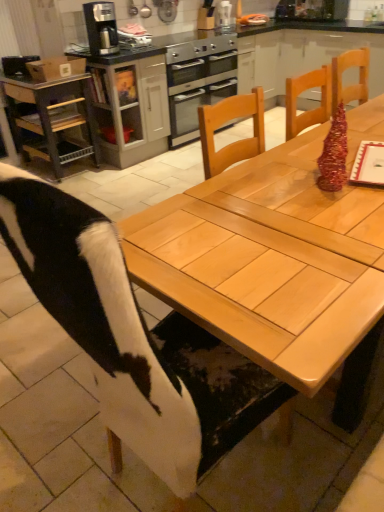
What are the coordinates of `metallic gray cart at left` in the screenshot? It's located at (52, 119).

Measure the distance between satin black coffee maker at upper left and camera.

satin black coffee maker at upper left is 3.31 meters away from camera.

In order to face satin black coffee maker at upper left, should I rotate leftwards or rightwards?

Turn left by 11.685 degrees to look at satin black coffee maker at upper left.

Describe the element at coordinates (224, 16) in the screenshot. I see `metallic silver toaster at upper center` at that location.

Locate an element on the screen. The image size is (384, 512). metallic silver toaster at upper center is located at coordinates (224, 16).

Where is `cowhide at center`? This screenshot has height=512, width=384. cowhide at center is located at coordinates (102, 322).

Describe the element at coordinates (285, 255) in the screenshot. I see `natural wood table at center` at that location.

Find the location of a particular element. This screenshot has width=384, height=512. metallic gray cart at left is located at coordinates (52, 119).

How different are the orientations of metallic gray cart at left and metallic silver toaster at upper center in degrees?

There is a 2.63-degree angle between the facing directions of metallic gray cart at left and metallic silver toaster at upper center.

You are a GUI agent. You are given a task and a screenshot of the screen. Output one action in this format:
    pyautogui.click(x=<x>, y=<y>)
    Task: Click on the desk that appears below the metallic silver toaster at upper center (from a real-world perspective)
    This screenshot has width=384, height=512.
    Given the screenshot: What is the action you would take?
    52,119

In terms of height, does metallic gray cart at left look taller or shorter compared to metallic silver toaster at upper center?

Considering their sizes, metallic gray cart at left has more height than metallic silver toaster at upper center.

Which of these two, natural wood table at center or cowhide at center, is thinner?

cowhide at center.

Is cowhide at center located within natural wood table at center?

Yes, cowhide at center is surrounded by natural wood table at center.

Where is `chair above the natural wood table at center (from a real-world perspective)`? The height and width of the screenshot is (512, 384). chair above the natural wood table at center (from a real-world perspective) is located at coordinates (102, 322).

In the scene shown: What's the angular difference between natural wood table at center and cowhide at center's facing directions?

90 degrees separate the facing orientations of natural wood table at center and cowhide at center.

Measure the distance between metallic gray cart at left and stainless steel oven at center.

They are 1.10 meters apart.

Which is in front, point (48, 152) or point (181, 114)?

The point (48, 152) is closer.

How different are the orientations of metallic gray cart at left and stainless steel oven at center in degrees?

There is a 1.82-degree angle between the facing directions of metallic gray cart at left and stainless steel oven at center.

Considering the relative sizes of metallic gray cart at left and stainless steel oven at center in the image provided, is metallic gray cart at left wider than stainless steel oven at center?

Indeed, metallic gray cart at left has a greater width compared to stainless steel oven at center.

Considering the sizes of objects satin black coffee maker at upper left and stainless steel oven at center in the image provided, who is bigger, satin black coffee maker at upper left or stainless steel oven at center?

stainless steel oven at center is bigger.

Does satin black coffee maker at upper left turn towards stainless steel oven at center?

No, satin black coffee maker at upper left is not aimed at stainless steel oven at center.

From a real-world perspective, is satin black coffee maker at upper left located beneath stainless steel oven at center?

No, from a real-world perspective, satin black coffee maker at upper left is not below stainless steel oven at center.

From the image's perspective, relative to natural wood table at center, is satin black coffee maker at upper left above or below?

satin black coffee maker at upper left is situated higher than natural wood table at center in the image.

Does point (88, 27) lie behind point (271, 150)?

Yes.

Where is `kitchen appliance that appears above the natural wood table at center (from a real-world perspective)`? The width and height of the screenshot is (384, 512). kitchen appliance that appears above the natural wood table at center (from a real-world perspective) is located at coordinates (101, 28).

Does point (225, 9) come behind point (154, 446)?

Yes.

Could cowhide at center be considered to be inside metallic silver toaster at upper center?

No.

Is metallic silver toaster at upper center looking in the opposite direction of cowhide at center?

metallic silver toaster at upper center is not turned away from cowhide at center.

Which of these two, metallic silver toaster at upper center or cowhide at center, is smaller?

metallic silver toaster at upper center is smaller.

Is satin black coffee maker at upper left facing away from metallic gray cart at left?

No, metallic gray cart at left is not at the back of satin black coffee maker at upper left.

Can you confirm if satin black coffee maker at upper left is thinner than metallic gray cart at left?

Indeed, satin black coffee maker at upper left has a lesser width compared to metallic gray cart at left.

Is satin black coffee maker at upper left not within metallic gray cart at left?

Yes.

Based on the photo, is the depth of satin black coffee maker at upper left greater than that of metallic gray cart at left?

No, it is in front of metallic gray cart at left.

Where is `appliance above the metallic gray cart at left (from the image's perspective)`? The image size is (384, 512). appliance above the metallic gray cart at left (from the image's perspective) is located at coordinates (224, 16).

The image size is (384, 512). Find the location of `chair below the natural wood table at center (from the image's perspective)`. chair below the natural wood table at center (from the image's perspective) is located at coordinates (102, 322).

Considering their positions, is metallic silver toaster at upper center positioned further to satin black coffee maker at upper left than cowhide at center?

cowhide at center lies further to satin black coffee maker at upper left than the other object.

Looking at the image, which one is located further to metallic gray cart at left, natural wood table at center or stainless steel oven at center?

natural wood table at center is further to metallic gray cart at left.

Based on their spatial positions, is satin black coffee maker at upper left or cowhide at center closer to natural wood table at center?

The object closer to natural wood table at center is cowhide at center.

Which object lies further to the anchor point metallic gray cart at left, satin black coffee maker at upper left or cowhide at center?

cowhide at center is further to metallic gray cart at left.

From the image, which object appears to be nearer to satin black coffee maker at upper left, metallic gray cart at left or metallic silver toaster at upper center?

metallic gray cart at left is positioned closer to the anchor satin black coffee maker at upper left.

Looking at the image, which one is located closer to stainless steel oven at center, cowhide at center or metallic gray cart at left?

metallic gray cart at left is closer to stainless steel oven at center.

From the image, which object appears to be farther from metallic silver toaster at upper center, satin black coffee maker at upper left or natural wood table at center?

natural wood table at center is further to metallic silver toaster at upper center.

Considering their positions, is satin black coffee maker at upper left positioned further to natural wood table at center than metallic silver toaster at upper center?

Based on the image, metallic silver toaster at upper center appears to be further to natural wood table at center.

Identify the location of kitchen appliance between cowhide at center and stainless steel oven at center from front to back. Image resolution: width=384 pixels, height=512 pixels. (101, 28).

At what (x,y) coordinates should I click in order to perform the action: click on table between cowhide at center and satin black coffee maker at upper left in the front-back direction. Please return your answer as a coordinate pair (x, y). Looking at the image, I should click on 285,255.

I want to click on oven positioned between cowhide at center and metallic silver toaster at upper center from near to far, so click(x=198, y=82).

At what (x,y) coordinates should I click in order to perform the action: click on desk positioned between cowhide at center and stainless steel oven at center from near to far. Please return your answer as a coordinate pair (x, y). Looking at the image, I should click on (52, 119).